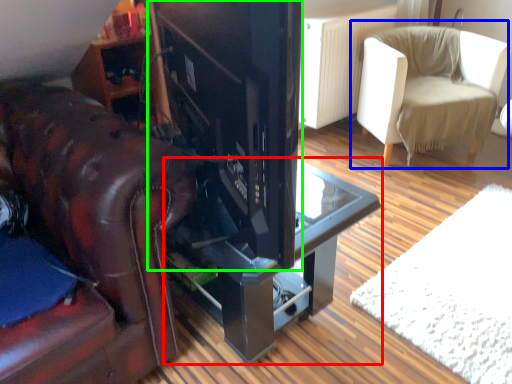
Question: Considering the real-world distances, which object is farthest from table (highlighted by a red box)? chair (highlighted by a blue box) or appliance (highlighted by a green box)?

Choices:
 (A) chair
 (B) appliance

Answer: (A)